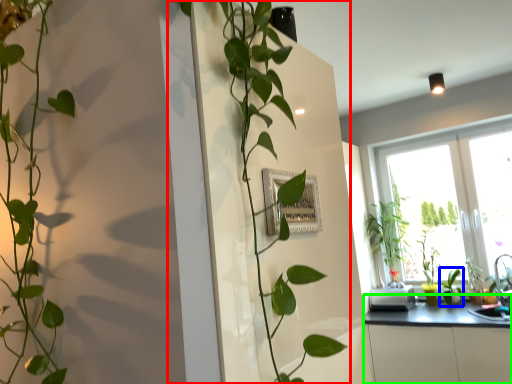
Question: Which object is the farthest from houseplant (highlighted by a red box)? Choose among these: plant (highlighted by a blue box) or counter top (highlighted by a green box).

Choices:
 (A) plant
 (B) counter top

Answer: (A)